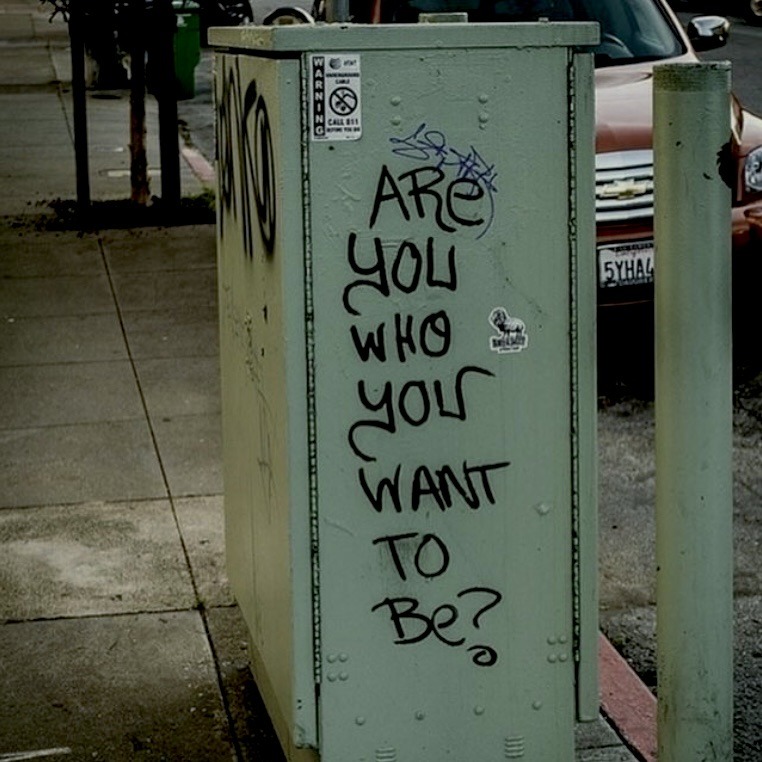
Locate an element on the screen. This screenshot has height=762, width=762. waste basket is located at coordinates (190, 45).